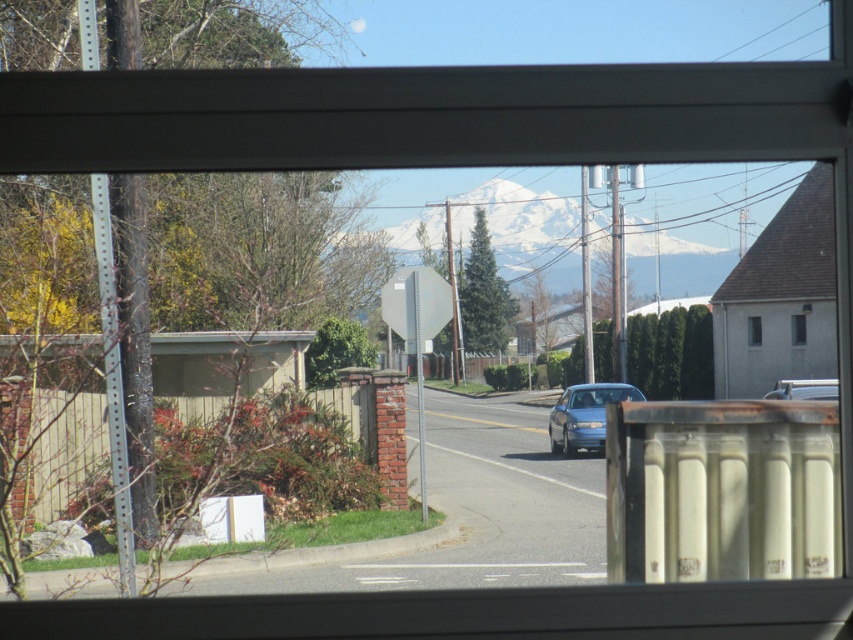
Question: Which object is the closest to the white snow-covered mountain at center?

Choices:
 (A) transparent glass window at center
 (B) metallic gray stop sign at center

Answer: (A)

Question: Does matte blue sedan at center have a lesser width compared to transparent glass window at center?

Choices:
 (A) no
 (B) yes

Answer: (A)

Question: Does metallic gray stop sign at center appear on the left side of white matte window at upper right?

Choices:
 (A) yes
 (B) no

Answer: (A)

Question: Is matte blue sedan at center in front of transparent glass window at center?

Choices:
 (A) no
 (B) yes

Answer: (B)

Question: Which of the following is the closest to the observer?

Choices:
 (A) (824, 400)
 (B) (759, 330)

Answer: (A)

Question: Which point appears farthest from the camera in this image?

Choices:
 (A) (622, 396)
 (B) (802, 330)

Answer: (B)